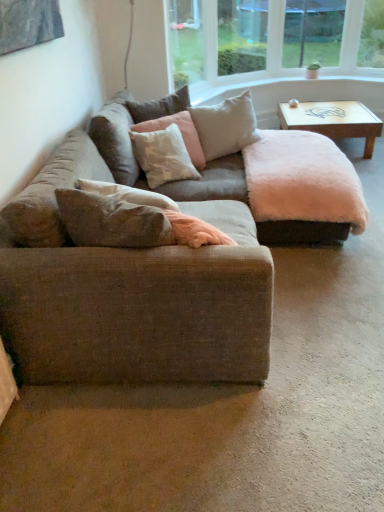
Identify the location of soft beige fabric pillow at center, the fourth pillow from the back. This screenshot has width=384, height=512. (111, 221).

What do you see at coordinates (161, 267) in the screenshot?
I see `textured beige couch at center` at bounding box center [161, 267].

Locate an element on the screen. clear glass window screen at upper center, arranged as the 2th window screen when viewed from the left is located at coordinates (312, 32).

Measure the distance between wooden coffee table at upper right and camera.

They are 3.73 meters apart.

How much space does transparent glass window screen at upper center, marked as the 2th window screen in a right-to-left arrangement, occupy vertically?

The height of transparent glass window screen at upper center, marked as the 2th window screen in a right-to-left arrangement, is 30.76 inches.

Measure the distance between soft beige cushion at upper center, which ranks as the 4th pillow in front-to-back order, and camera.

soft beige cushion at upper center, which ranks as the 4th pillow in front-to-back order, and camera are 2.85 meters apart from each other.

You are a GUI agent. You are given a task and a screenshot of the screen. Output one action in this format:
    pyautogui.click(x=<x>, y=<y>)
    Task: Click on the soft beige fabric pillow at center, which ranks as the first pillow in front-to-back order
    The height and width of the screenshot is (512, 384).
    Given the screenshot: What is the action you would take?
    pyautogui.click(x=111, y=221)

Based on their positions, is transparent glass window screen at upper center, marked as the 2th window screen in a right-to-left arrangement, located to the left or right of soft beige cushion at upper center, which ranks as the 4th pillow in front-to-back order?

From the image, it's evident that transparent glass window screen at upper center, marked as the 2th window screen in a right-to-left arrangement, is to the right of soft beige cushion at upper center, which ranks as the 4th pillow in front-to-back order.

From the picture: Is transparent glass window screen at upper center, which is the first window screen from left to right, bigger or smaller than soft beige cushion at upper center, which ranks as the 4th pillow in front-to-back order?

Considering their sizes, transparent glass window screen at upper center, which is the first window screen from left to right, takes up more space than soft beige cushion at upper center, which ranks as the 4th pillow in front-to-back order.

How far apart are transparent glass window screen at upper center, marked as the 2th window screen in a right-to-left arrangement, and soft beige cushion at upper center, which ranks as the 4th pillow in front-to-back order?

transparent glass window screen at upper center, marked as the 2th window screen in a right-to-left arrangement, and soft beige cushion at upper center, which ranks as the 4th pillow in front-to-back order, are 1.88 meters apart.

Is transparent glass window screen at upper center, which is the first window screen from left to right, inside the boundaries of soft beige cushion at upper center, marked as the first pillow in a back-to-front arrangement, or outside?

transparent glass window screen at upper center, which is the first window screen from left to right, lies outside soft beige cushion at upper center, marked as the first pillow in a back-to-front arrangement.

From the image's perspective, relative to light beige fabric pillow at center, the 3th pillow viewed from the front, is textured beige couch at center above or below?

Based on their image positions, textured beige couch at center is located beneath light beige fabric pillow at center, the 3th pillow viewed from the front.

Locate an element on the screen. studio couch lying on the left of light beige fabric pillow at center, which ranks as the 2th pillow in back-to-front order is located at coordinates (161, 267).

Considering the relative sizes of textured beige couch at center and light beige fabric pillow at center, the 3th pillow viewed from the front, in the image provided, is textured beige couch at center smaller than light beige fabric pillow at center, the 3th pillow viewed from the front,?

Incorrect, textured beige couch at center is not smaller in size than light beige fabric pillow at center, the 3th pillow viewed from the front.

Which is correct: textured beige couch at center is inside light beige fabric pillow at center, which ranks as the 2th pillow in back-to-front order, or outside of it?

textured beige couch at center is not inside light beige fabric pillow at center, which ranks as the 2th pillow in back-to-front order, it's outside.

Considering the positions of point (140, 176) and point (116, 241), is point (140, 176) closer or farther from the camera than point (116, 241)?

Point (140, 176) is farther from the camera than point (116, 241).

Identify the location of pillow in front of the textured beige couch at center. This screenshot has width=384, height=512. (111, 221).

Considering the relative positions of textured beige couch at center and soft beige fabric pillow at center, which ranks as the first pillow in front-to-back order, in the image provided, is textured beige couch at center to the left or to the right of soft beige fabric pillow at center, which ranks as the first pillow in front-to-back order,?

textured beige couch at center is positioned on soft beige fabric pillow at center, which ranks as the first pillow in front-to-back order,'s right side.

Consider the image. Between soft beige cushion at upper center, which ranks as the 4th pillow in front-to-back order, and soft beige fabric pillow at center, the fourth pillow from the back, which one has more height?

soft beige cushion at upper center, which ranks as the 4th pillow in front-to-back order.

From a real-world perspective, is soft beige cushion at upper center, marked as the first pillow in a back-to-front arrangement, positioned under soft beige fabric pillow at center, the fourth pillow from the back, based on gravity?

No, from a real-world perspective, soft beige cushion at upper center, marked as the first pillow in a back-to-front arrangement, is not below soft beige fabric pillow at center, the fourth pillow from the back.

Relative to soft beige fabric pillow at center, which ranks as the first pillow in front-to-back order, is soft beige cushion at upper center, marked as the first pillow in a back-to-front arrangement, in front or behind?

In the image, soft beige cushion at upper center, marked as the first pillow in a back-to-front arrangement, appears behind soft beige fabric pillow at center, which ranks as the first pillow in front-to-back order.

Is soft beige cushion at upper center, marked as the first pillow in a back-to-front arrangement, wider or thinner than soft beige fabric pillow at center, which ranks as the first pillow in front-to-back order?

In the image, soft beige cushion at upper center, marked as the first pillow in a back-to-front arrangement, appears to be wider than soft beige fabric pillow at center, which ranks as the first pillow in front-to-back order.

Do you think textured beige couch at center is within clear glass window screen at upper center, the 1th window screen positioned from the right, or outside of it?

textured beige couch at center is not inside clear glass window screen at upper center, the 1th window screen positioned from the right, it's outside.

From a real-world perspective, is textured beige couch at center positioned under clear glass window screen at upper center, arranged as the 2th window screen when viewed from the left, based on gravity?

Yes, from a real-world perspective, textured beige couch at center is below clear glass window screen at upper center, arranged as the 2th window screen when viewed from the left.

From the picture: Is textured beige couch at center far away from clear glass window screen at upper center, the 1th window screen positioned from the right?

Yes.

Does soft beige cushion at upper center, marked as the first pillow in a back-to-front arrangement, lie behind light beige fabric pillow at center, the 3th pillow viewed from the front?

Yes, the depth of soft beige cushion at upper center, marked as the first pillow in a back-to-front arrangement, is greater than that of light beige fabric pillow at center, the 3th pillow viewed from the front.

Is soft beige cushion at upper center, which ranks as the 4th pillow in front-to-back order, touching light beige fabric pillow at center, the 3th pillow viewed from the front?

soft beige cushion at upper center, which ranks as the 4th pillow in front-to-back order, is not next to light beige fabric pillow at center, the 3th pillow viewed from the front, and they're not touching.

Does soft beige cushion at upper center, which ranks as the 4th pillow in front-to-back order, turn towards light beige fabric pillow at center, which ranks as the 2th pillow in back-to-front order?

Yes, soft beige cushion at upper center, which ranks as the 4th pillow in front-to-back order, is facing light beige fabric pillow at center, which ranks as the 2th pillow in back-to-front order.

Does soft pink fabric pillow at center, positioned as the third pillow in back-to-front order, turn towards wooden coffee table at upper right?

Yes.

Considering the sizes of soft pink fabric pillow at center, positioned as the 2th pillow in front-to-back order, and wooden coffee table at upper right in the image, is soft pink fabric pillow at center, positioned as the 2th pillow in front-to-back order, wider or thinner than wooden coffee table at upper right?

soft pink fabric pillow at center, positioned as the 2th pillow in front-to-back order, is thinner than wooden coffee table at upper right.

Which of these two, soft pink fabric pillow at center, positioned as the third pillow in back-to-front order, or wooden coffee table at upper right, stands shorter?

wooden coffee table at upper right is shorter.

From a real-world perspective, does soft pink fabric pillow at center, positioned as the third pillow in back-to-front order, stand above wooden coffee table at upper right?

Indeed, from a real-world perspective, soft pink fabric pillow at center, positioned as the third pillow in back-to-front order, stands above wooden coffee table at upper right.

Which pillow is the 1st one when counting from the front of the transparent glass window screen at upper center, which is the first window screen from left to right? Please provide its 2D coordinates.

[(159, 106)]

You are a GUI agent. You are given a task and a screenshot of the screen. Output one action in this format:
    pyautogui.click(x=<x>, y=<y>)
    Task: Click on the studio couch below the light beige fabric pillow at center, which ranks as the 2th pillow in back-to-front order (from the image's perspective)
    
    Given the screenshot: What is the action you would take?
    pyautogui.click(x=161, y=267)

Looking at the image, which one is located closer to soft beige fabric pillow at center, which ranks as the first pillow in front-to-back order, textured beige couch at center or textured beige couch at center?

Based on the image, textured beige couch at center appears to be nearer to soft beige fabric pillow at center, which ranks as the first pillow in front-to-back order.

From the image, which object appears to be farther from textured beige couch at center, wooden coffee table at upper right or textured beige couch at center?

Based on the image, wooden coffee table at upper right appears to be further to textured beige couch at center.

Estimate the real-world distances between objects in this image. Which object is closer to textured beige couch at center, soft beige cushion at upper center, which ranks as the 4th pillow in front-to-back order, or textured beige couch at center?

Among the two, soft beige cushion at upper center, which ranks as the 4th pillow in front-to-back order, is located nearer to textured beige couch at center.

Estimate the real-world distances between objects in this image. Which object is closer to wooden coffee table at upper right, transparent glass window screen at upper center, which is the first window screen from left to right, or clear glass window screen at upper center, arranged as the 2th window screen when viewed from the left?

transparent glass window screen at upper center, which is the first window screen from left to right.

Estimate the real-world distances between objects in this image. Which object is closer to soft pink fabric pillow at center, positioned as the 2th pillow in front-to-back order, textured beige couch at center or clear glass window screen at upper center, arranged as the 2th window screen when viewed from the left?

textured beige couch at center lies closer to soft pink fabric pillow at center, positioned as the 2th pillow in front-to-back order, than the other object.

Consider the image. Looking at the image, which one is located closer to soft beige cushion at upper center, marked as the first pillow in a back-to-front arrangement, clear glass window screen at upper center, the 1th window screen positioned from the right, or textured beige couch at center?

textured beige couch at center lies closer to soft beige cushion at upper center, marked as the first pillow in a back-to-front arrangement, than the other object.

From the picture: Based on their spatial positions, is soft beige fabric pillow at center, the fourth pillow from the back, or soft beige cushion at upper center, which ranks as the 4th pillow in front-to-back order, closer to wooden coffee table at upper right?

soft beige cushion at upper center, which ranks as the 4th pillow in front-to-back order, lies closer to wooden coffee table at upper right than the other object.

Looking at the image, which one is located closer to wooden coffee table at upper right, light beige fabric pillow at center, which ranks as the 2th pillow in back-to-front order, or clear glass window screen at upper center, arranged as the 2th window screen when viewed from the left?

light beige fabric pillow at center, which ranks as the 2th pillow in back-to-front order, is positioned closer to the anchor wooden coffee table at upper right.

This screenshot has height=512, width=384. Find the location of `pillow located between soft beige cushion at upper center, which ranks as the 4th pillow in front-to-back order, and light beige fabric pillow at center, which ranks as the 2th pillow in back-to-front order, in the left-right direction`. pillow located between soft beige cushion at upper center, which ranks as the 4th pillow in front-to-back order, and light beige fabric pillow at center, which ranks as the 2th pillow in back-to-front order, in the left-right direction is located at coordinates (181, 133).

You are a GUI agent. You are given a task and a screenshot of the screen. Output one action in this format:
    pyautogui.click(x=<x>, y=<y>)
    Task: Click on the couch between soft beige fabric pillow at center, which ranks as the first pillow in front-to-back order, and soft beige cushion at upper center, marked as the first pillow in a back-to-front arrangement, from front to back
    This screenshot has width=384, height=512.
    Given the screenshot: What is the action you would take?
    pyautogui.click(x=126, y=131)

Identify the location of couch between soft beige fabric pillow at center, the fourth pillow from the back, and soft pink fabric pillow at center, positioned as the third pillow in back-to-front order, from front to back. click(126, 131).

You are a GUI agent. You are given a task and a screenshot of the screen. Output one action in this format:
    pyautogui.click(x=<x>, y=<y>)
    Task: Click on the couch between textured beige couch at center and soft pink fabric pillow at center, positioned as the third pillow in back-to-front order, in the front-back direction
    
    Given the screenshot: What is the action you would take?
    pyautogui.click(x=126, y=131)